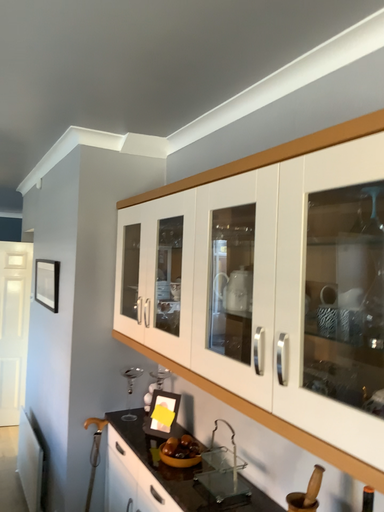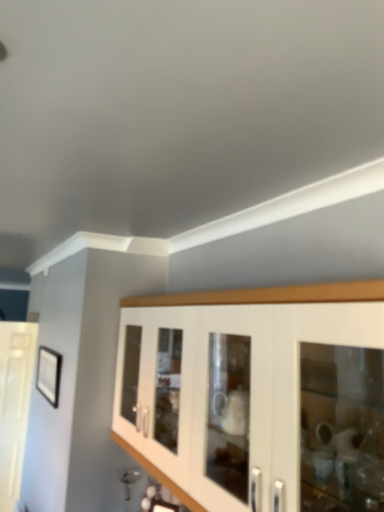
Question: Which way did the camera rotate in the video?

Choices:
 (A) rotated upward
 (B) rotated downward

Answer: (A)